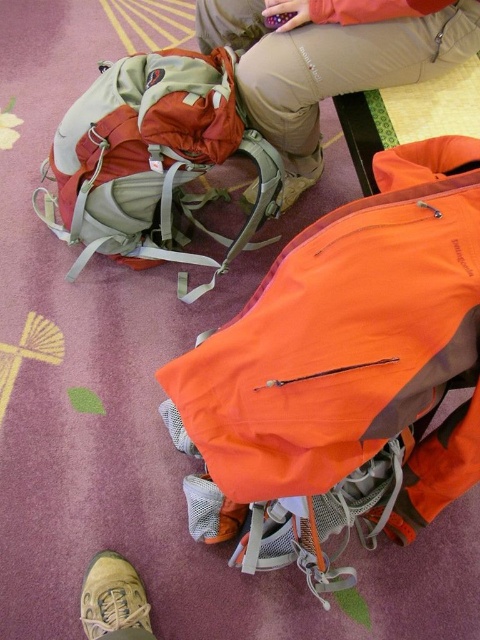
You are a delivery person who needs to place a rectangular box that is 15 inches tall. You see the orange fabric backpack at center and the orange fabric pants at center. Which object can the box fit on top of without exceeding its height?

The orange fabric backpack at center has a greater height compared to orange fabric pants at center, so the box can be placed on top of the orange fabric backpack at center since it is taller.

You are standing in front of two hiking backpacks on the carpeted floor. You notice a point marked at coordinates (343, 372). Which backpack is located at that point?

The orange fabric backpack at center is located at point (343, 372).

From the picture: You are a delivery person who needs to place a package between the orange fabric backpack at center and the tan suede shoe at lower left. Can you fit the package vertically between them?

The orange fabric backpack at center is much taller than the tan suede shoe at lower left, so the vertical space between them is sufficient to fit the package.